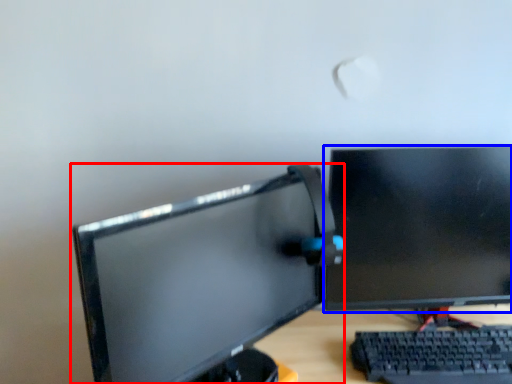
Question: Which object appears farthest to the camera in this image, computer monitor (highlighted by a red box) or computer monitor (highlighted by a blue box)?

Choices:
 (A) computer monitor
 (B) computer monitor

Answer: (B)